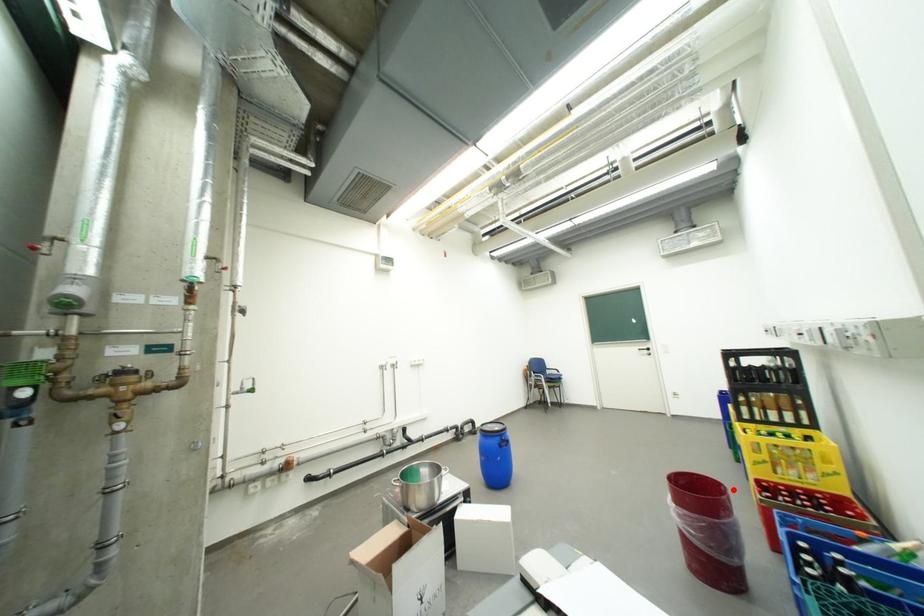
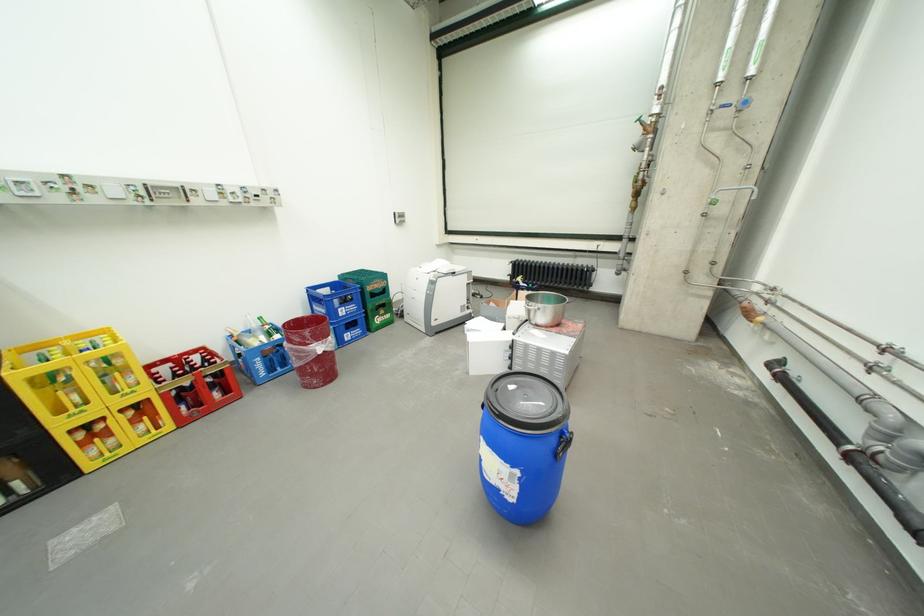
Question: I am providing you with two images of the same scene from different viewpoints. A red point is marked on the first image. Can you still see the location of the red point in image 2?

Choices:
 (A) Yes
 (B) No

Answer: (A)